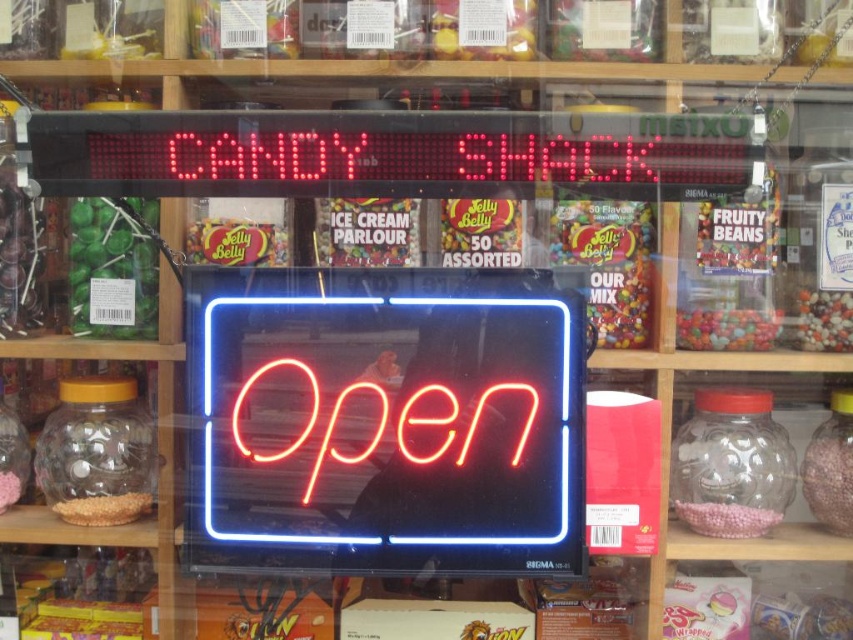
Question: Considering the real-world distances, which object is farthest from the pink matte candy jar at right?

Choices:
 (A) multicolored candy at center
 (B) pink matte candy at lower right
 (C) green matte gummy bear at left

Answer: (C)

Question: Based on their relative distances, which object is nearer to the multicolored candy at center?

Choices:
 (A) pink matte candy jar at right
 (B) shiny yellow jelly bean at center left
 (C) crumbly brown at lower left
 (D) pink matte candy at lower right

Answer: (B)

Question: Does multicolored candy at center appear over shiny yellow jelly bean at center left?

Choices:
 (A) yes
 (B) no

Answer: (A)

Question: Can you confirm if pink matte candy jar at right is positioned above pink matte candy at lower right?

Choices:
 (A) no
 (B) yes

Answer: (B)

Question: Is pink matte candy at lower right above crumbly brown at lower left?

Choices:
 (A) yes
 (B) no

Answer: (B)

Question: Which object appears farthest from the camera in this image?

Choices:
 (A) neon sign at center
 (B) multicolored candy at center
 (C) crumbly brown at lower left
 (D) shiny yellow jelly bean at center left

Answer: (B)